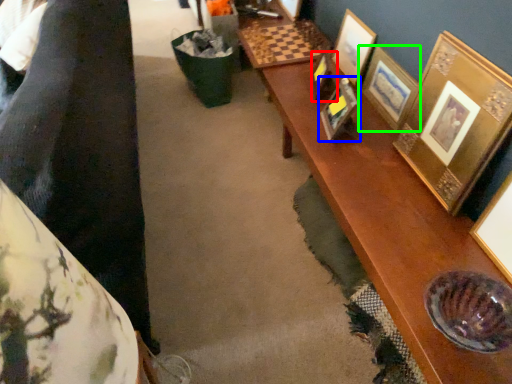
Question: Considering the real-world distances, which object is closest to picture frame (highlighted by a red box)? picture frame (highlighted by a blue box) or picture frame (highlighted by a green box).

Choices:
 (A) picture frame
 (B) picture frame

Answer: (A)